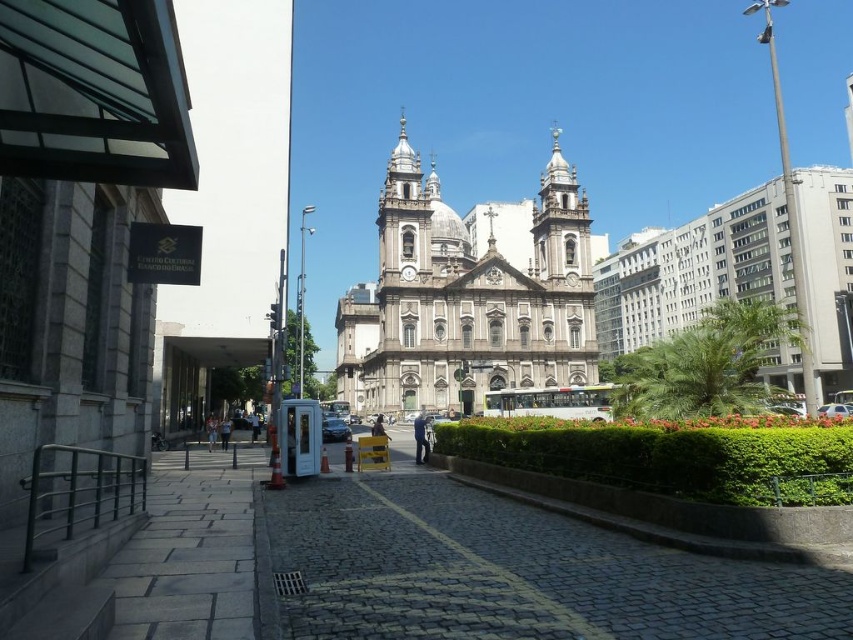
Is white marble church at center positioned in front of black glossy car at center?

No, it is not.

Is point (556, 332) positioned after point (332, 435)?

Yes, point (556, 332) is behind point (332, 435).

Based on the photo, measure the distance between point (497,356) and camera.

Point (497,356) and camera are 104.77 meters apart.

Find the location of a particular element. This screenshot has width=853, height=640. white marble church at center is located at coordinates (468, 296).

Is the position of white stone church at center less distant than that of silver metallic car at center?

That is False.

Is white stone church at center positioned at the back of silver metallic car at center?

Yes, white stone church at center is further from the viewer.

Which is behind, point (602, 305) or point (840, 417)?

Point (602, 305)

Image resolution: width=853 pixels, height=640 pixels. What are the coordinates of `white stone church at center` in the screenshot? It's located at (693, 269).

Is white stone church at center above black glossy car at center?

Indeed, white stone church at center is positioned over black glossy car at center.

Does white stone church at center have a larger size compared to black glossy car at center?

Indeed, white stone church at center has a larger size compared to black glossy car at center.

Where is `white stone church at center`? The width and height of the screenshot is (853, 640). white stone church at center is located at coordinates (693, 269).

This screenshot has width=853, height=640. What are the coordinates of `white stone church at center` in the screenshot? It's located at (693, 269).